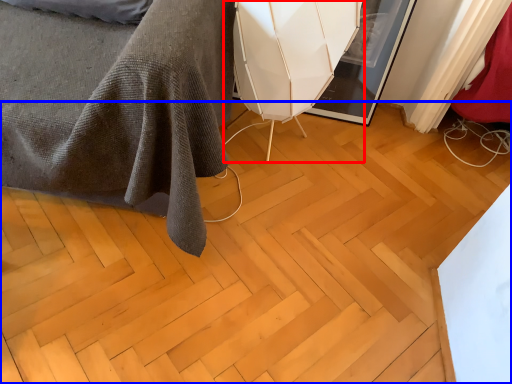
Question: Which of the following is the farthest to the observer, swivel chair (highlighted by a red box) or plywood (highlighted by a blue box)?

Choices:
 (A) swivel chair
 (B) plywood

Answer: (A)